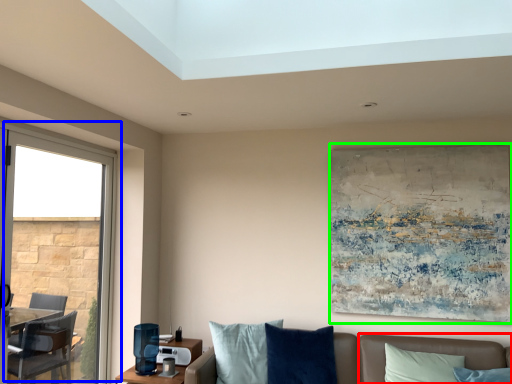
Question: Considering the real-world distances, which object is farthest from couch (highlighted by a red box)? window (highlighted by a blue box) or picture frame (highlighted by a green box)?

Choices:
 (A) window
 (B) picture frame

Answer: (A)